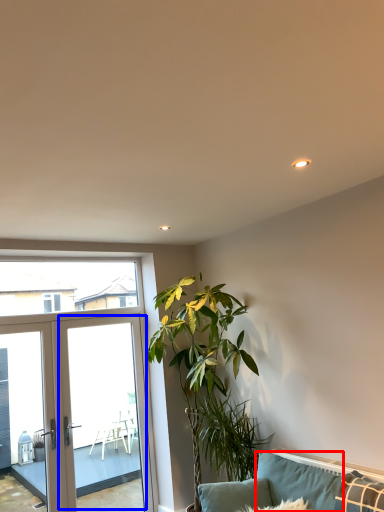
Question: Which object is closer to the camera taking this photo, pillow (highlighted by a red box) or screen door (highlighted by a blue box)?

Choices:
 (A) pillow
 (B) screen door

Answer: (A)